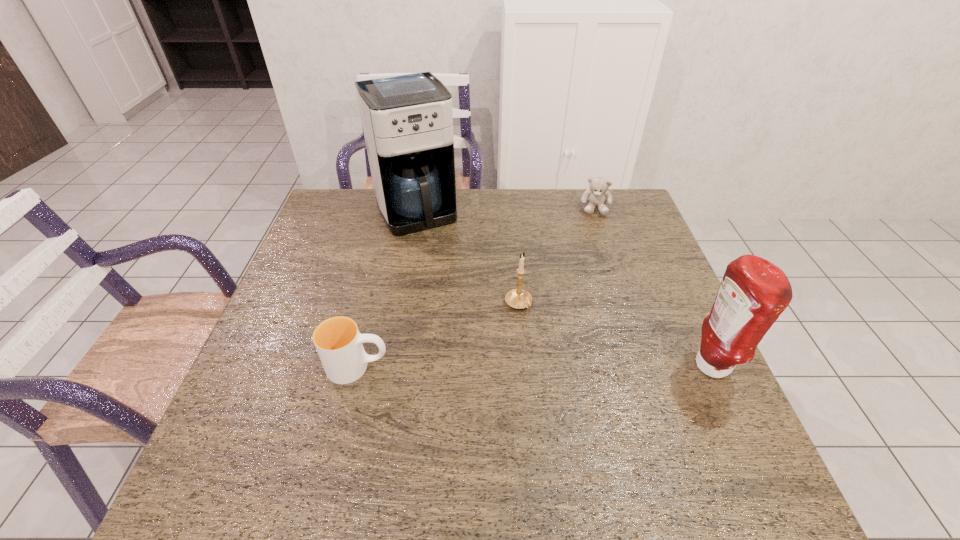
At what (x,y) coordinates should I click in order to perform the action: click on free point between the second tallest object and the third tallest object. Please return your answer as a coordinate pair (x, y). This screenshot has width=960, height=540. Looking at the image, I should click on (615, 335).

Identify the location of free space that is in between the tallest object and the teddy bear. (506, 210).

You are a GUI agent. You are given a task and a screenshot of the screen. Output one action in this format:
    pyautogui.click(x=<x>, y=<y>)
    Task: Click on the empty location between the tallest object and the rightmost object
    
    Given the screenshot: What is the action you would take?
    pyautogui.click(x=564, y=289)

This screenshot has height=540, width=960. I want to click on free space between the teddy bear and the coffee maker, so click(x=506, y=210).

At what (x,y) coordinates should I click in order to perform the action: click on blank region between the tallest object and the candle holder. Please return your answer as a coordinate pair (x, y). Looking at the image, I should click on point(467,258).

Locate an element on the screen. The image size is (960, 540). free space between the third tallest object and the cup is located at coordinates (438, 335).

Image resolution: width=960 pixels, height=540 pixels. I want to click on unoccupied position between the second object from right to left and the cup, so click(477, 287).

Where is `unoccupied area between the cup and the tallest object`? This screenshot has width=960, height=540. unoccupied area between the cup and the tallest object is located at coordinates (387, 290).

You are a GUI agent. You are given a task and a screenshot of the screen. Output one action in this format:
    pyautogui.click(x=<x>, y=<y>)
    Task: Click on the empty space between the second object from right to left and the tallest object
    
    Given the screenshot: What is the action you would take?
    pyautogui.click(x=506, y=210)

In order to click on free spot between the fourth shortest object and the cup in this screenshot , I will do `click(535, 366)`.